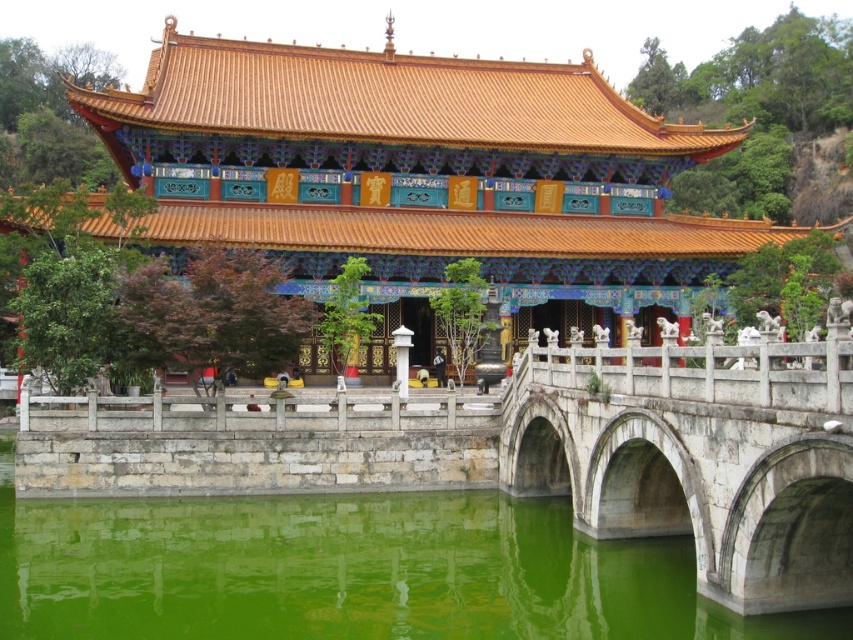
Question: Which of the following is the farthest from the observer?

Choices:
 (A) shiny gold roof at center
 (B) white stone bridge at center

Answer: (A)

Question: Is shiny gold roof at center bigger than white stone bridge at center?

Choices:
 (A) yes
 (B) no

Answer: (A)

Question: Is shiny gold roof at center positioned at the back of white stone bridge at center?

Choices:
 (A) yes
 (B) no

Answer: (A)

Question: Considering the relative positions of shiny gold roof at center and white stone bridge at center in the image provided, where is shiny gold roof at center located with respect to white stone bridge at center?

Choices:
 (A) above
 (B) below

Answer: (A)